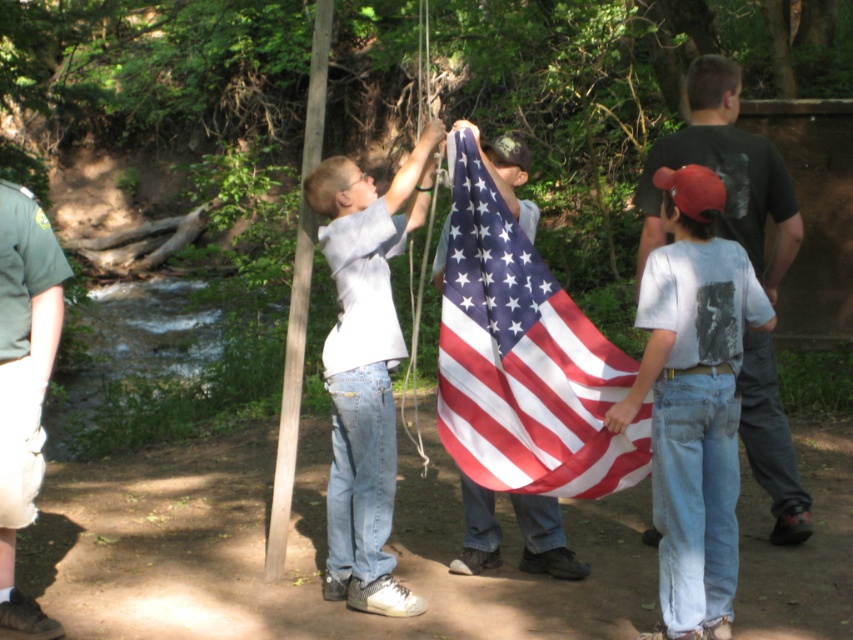
Between american flag at center and dark green t-shirt at center, which one has more height?

With more height is dark green t-shirt at center.

Who is shorter, american flag at center or dark green t-shirt at center?

american flag at center

Locate an element on the screen. Image resolution: width=853 pixels, height=640 pixels. american flag at center is located at coordinates (523, 358).

Between dark green t-shirt at center and smooth wooden pole at center, which one has less height?

With less height is smooth wooden pole at center.

Does point (770, 440) lie in front of point (289, 372)?

No, it is behind (289, 372).

What do you see at coordinates (724, 173) in the screenshot?
I see `dark green t-shirt at center` at bounding box center [724, 173].

I want to click on dark green t-shirt at center, so click(x=724, y=173).

Which is above, light blue jeans at center or green uniform at left?

light blue jeans at center is above.

Measure the distance between point (328, 374) and camera.

Point (328, 374) and camera are 20.22 feet apart.

This screenshot has width=853, height=640. I want to click on light blue jeans at center, so click(364, 369).